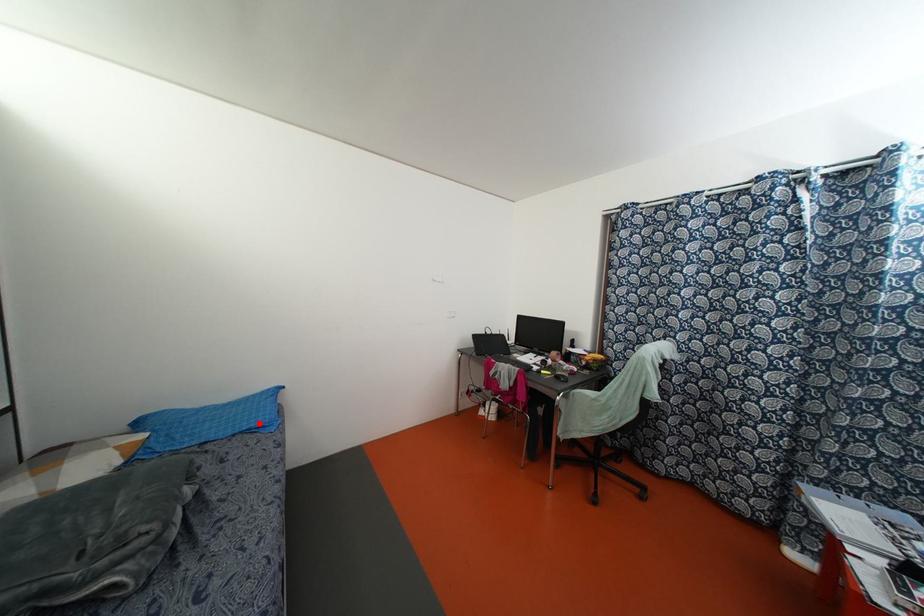
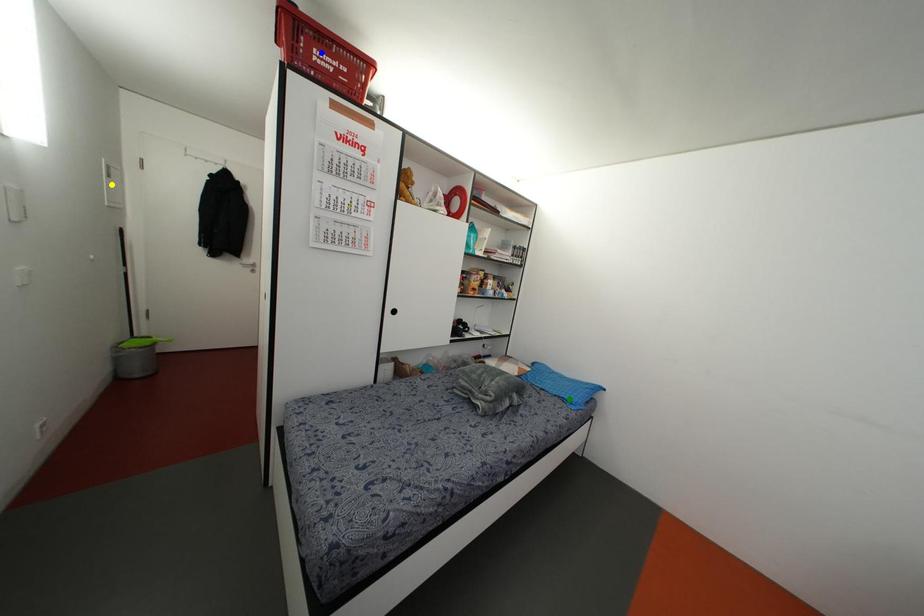
Question: I am providing you with two images of the same scene from different viewpoints. A red point is marked on the first image. You are given multiple points on the second image. In image 2, which mark is for the same physical point as the one in image 1?

Choices:
 (A) yellow point
 (B) green point
 (C) blue point

Answer: (B)